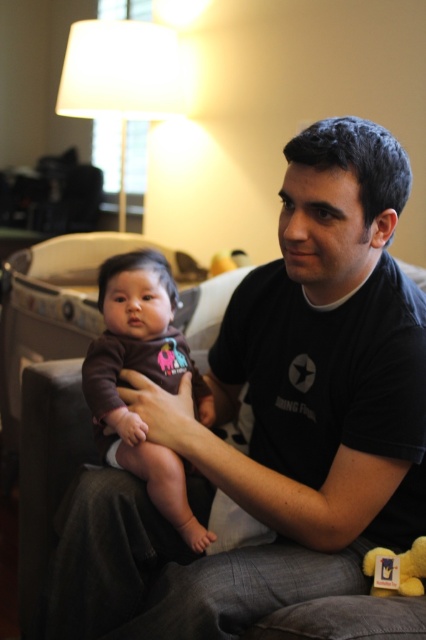
You are a photographer trying to capture a closeup of the black cotton shirt at center and the brown soft fabric baby at center. Since you can only focus on one subject at a time, which one should you choose if you want the one closer to the camera to be in focus?

The black cotton shirt at center is positioned on the right side of brown soft fabric baby at center, so if you want the one closer to the camera to be in focus, you should choose the brown soft fabric baby at center because it is closer to the camera than the black cotton shirt at center.

You are a photographer setting up a shot of the man and baby. You need to ensure the black cotton shirt at center and brown soft fabric baby at center are both visible in the frame. Which object should you focus on to ensure both are in focus?

The black cotton shirt at center is taller than the brown soft fabric baby at center, so focusing on the black cotton shirt at center would ensure both are in focus since it is larger.